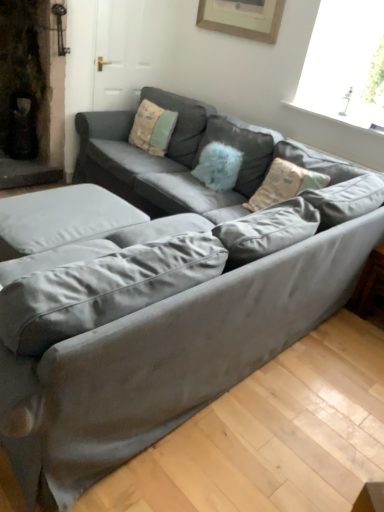
Question: Visually, is wooden side table at lower right positioned to the left or to the right of velvet beige pillow at center, arranged as the 2th pillow when viewed from the right?

Choices:
 (A) left
 (B) right

Answer: (B)

Question: Is wooden side table at lower right wider or thinner than velvet beige pillow at center, arranged as the 2th pillow when viewed from the right?

Choices:
 (A) wide
 (B) thin

Answer: (A)

Question: Which object is positioned closest to the wooden side table at lower right?

Choices:
 (A) fluffy blue pillow at center, which is the first pillow from right to left
 (B) satin gray couch at center
 (C) wooden picture frame at upper center
 (D) velvet beige pillow at center, arranged as the 2th pillow when viewed from the right

Answer: (A)

Question: Estimate the real-world distances between objects in this image. Which object is farther from the satin gray couch at center?

Choices:
 (A) fluffy blue pillow at center, which is counted as the second pillow, starting from the left
 (B) wooden picture frame at upper center
 (C) velvet beige pillow at center, arranged as the 2th pillow when viewed from the right
 (D) wooden side table at lower right

Answer: (D)